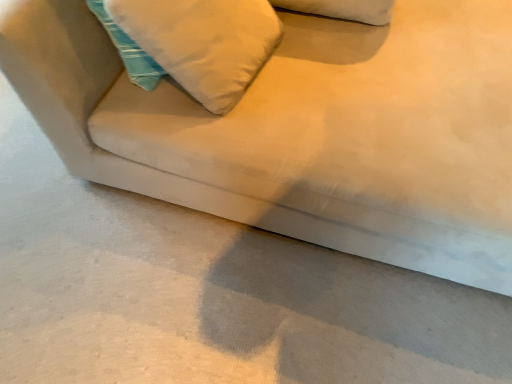
Describe the element at coordinates (203, 42) in the screenshot. I see `white soft pillow at upper left` at that location.

The image size is (512, 384). I want to click on white soft pillow at upper left, so click(203, 42).

Consider the image. Measure the distance between point (244, 23) and camera.

Point (244, 23) and camera are 1.27 meters apart from each other.

Locate an element on the screen. This screenshot has height=384, width=512. white soft pillow at upper left is located at coordinates (203, 42).